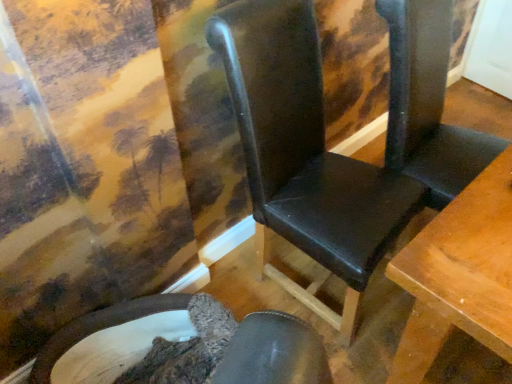
What do you see at coordinates (428, 103) in the screenshot? I see `black leather folding chair at center` at bounding box center [428, 103].

Measure the distance between velvet-like brown chair at lower left, the first chair when ordered from left to right, and camera.

velvet-like brown chair at lower left, the first chair when ordered from left to right, is 4.50 feet away from camera.

What is the approximate height of black leather chair at center, positioned as the first chair in right-to-left order?

3.62 feet.

This screenshot has height=384, width=512. I want to click on black leather folding chair at center, so click(x=428, y=103).

Is point (103, 369) positioned after point (467, 155)?

No, it is in front of (467, 155).

Considering the relative sizes of velvet-like brown chair at lower left, the first chair when ordered from left to right, and black leather folding chair at center in the image provided, is velvet-like brown chair at lower left, the first chair when ordered from left to right, thinner than black leather folding chair at center?

In fact, velvet-like brown chair at lower left, the first chair when ordered from left to right, might be wider than black leather folding chair at center.

Could you tell me if velvet-like brown chair at lower left, the first chair when ordered from left to right, is facing black leather folding chair at center?

No, velvet-like brown chair at lower left, the first chair when ordered from left to right, does not turn towards black leather folding chair at center.

Can you confirm if velvet-like brown chair at lower left, placed as the 2th chair when sorted from right to left, is bigger than black leather folding chair at center?

No, velvet-like brown chair at lower left, placed as the 2th chair when sorted from right to left, is not bigger than black leather folding chair at center.

Which object is wider, black leather chair at center, which is the second chair from left to right, or black leather folding chair at center?

black leather chair at center, which is the second chair from left to right, is wider.

Considering the sizes of black leather chair at center, positioned as the first chair in right-to-left order, and black leather folding chair at center in the image, is black leather chair at center, positioned as the first chair in right-to-left order, taller or shorter than black leather folding chair at center?

black leather chair at center, positioned as the first chair in right-to-left order, is shorter than black leather folding chair at center.

Which object is further away from the camera, black leather chair at center, which is the second chair from left to right, or black leather folding chair at center?

Positioned behind is black leather folding chair at center.

Is the surface of black leather folding chair at center in direct contact with black leather chair at center, positioned as the first chair in right-to-left order?

black leather folding chair at center and black leather chair at center, positioned as the first chair in right-to-left order, are clearly separated.

Would you say black leather chair at center, positioned as the first chair in right-to-left order, is part of black leather folding chair at center's contents?

No.

Is black leather chair at center, which is the second chair from left to right, at the back of black leather folding chair at center?

black leather folding chair at center is not turned away from black leather chair at center, which is the second chair from left to right.

Is point (391, 66) positioned after point (417, 76)?

Yes, it is.

Based on their sizes in the image, would you say velvet-like brown chair at lower left, the first chair when ordered from left to right, is bigger or smaller than black leather chair at center, positioned as the first chair in right-to-left order?

velvet-like brown chair at lower left, the first chair when ordered from left to right, is smaller than black leather chair at center, positioned as the first chair in right-to-left order.

Considering the relative sizes of velvet-like brown chair at lower left, the first chair when ordered from left to right, and black leather chair at center, which is the second chair from left to right, in the image provided, is velvet-like brown chair at lower left, the first chair when ordered from left to right, taller than black leather chair at center, which is the second chair from left to right,?

No, velvet-like brown chair at lower left, the first chair when ordered from left to right, is not taller than black leather chair at center, which is the second chair from left to right.

In the scene shown: Would you say velvet-like brown chair at lower left, the first chair when ordered from left to right, contains black leather chair at center, which is the second chair from left to right?

No.

Can you tell me how much velvet-like brown chair at lower left, the first chair when ordered from left to right, and black leather chair at center, which is the second chair from left to right, differ in facing direction?

velvet-like brown chair at lower left, the first chair when ordered from left to right, and black leather chair at center, which is the second chair from left to right, are facing 4.9 degrees away from each other.

Is velvet-like brown chair at lower left, the first chair when ordered from left to right, completely or partially inside black leather folding chair at center?

Actually, velvet-like brown chair at lower left, the first chair when ordered from left to right, is outside black leather folding chair at center.

Is black leather folding chair at center with velvet-like brown chair at lower left, the first chair when ordered from left to right?

No, black leather folding chair at center is not beside velvet-like brown chair at lower left, the first chair when ordered from left to right.

Is the depth of black leather folding chair at center greater than that of velvet-like brown chair at lower left, the first chair when ordered from left to right?

Yes, black leather folding chair at center is further from the viewer.

Does black leather folding chair at center turn towards velvet-like brown chair at lower left, the first chair when ordered from left to right?

No, black leather folding chair at center is not aimed at velvet-like brown chair at lower left, the first chair when ordered from left to right.

Can we say black leather chair at center, which is the second chair from left to right, lies outside velvet-like brown chair at lower left, the first chair when ordered from left to right?

Indeed, black leather chair at center, which is the second chair from left to right, is completely outside velvet-like brown chair at lower left, the first chair when ordered from left to right.

The height and width of the screenshot is (384, 512). In order to click on chair that appears on the left of black leather chair at center, positioned as the first chair in right-to-left order in this screenshot , I will do `click(109, 337)`.

Between point (256, 67) and point (61, 338), which one is positioned behind?

Positioned behind is point (61, 338).

Between black leather chair at center, which is the second chair from left to right, and velvet-like brown chair at lower left, the first chair when ordered from left to right, which one has less height?

With less height is velvet-like brown chair at lower left, the first chair when ordered from left to right.

Where is `the 2nd chair below the black leather folding chair at center (from a real-world perspective)`? the 2nd chair below the black leather folding chair at center (from a real-world perspective) is located at coordinates (109, 337).

Starting from the black leather folding chair at center, which chair is the 2nd one in front? Please provide its 2D coordinates.

[(337, 154)]

Which object lies further to the anchor point black leather folding chair at center, velvet-like brown chair at lower left, the first chair when ordered from left to right, or black leather chair at center, which is the second chair from left to right?

Based on the image, velvet-like brown chair at lower left, the first chair when ordered from left to right, appears to be further to black leather folding chair at center.

Considering their positions, is black leather folding chair at center positioned further to velvet-like brown chair at lower left, placed as the 2th chair when sorted from right to left, than black leather chair at center, which is the second chair from left to right?

black leather folding chair at center.

Looking at the image, which one is located further to black leather chair at center, which is the second chair from left to right, velvet-like brown chair at lower left, the first chair when ordered from left to right, or black leather folding chair at center?

Among the two, velvet-like brown chair at lower left, the first chair when ordered from left to right, is located further to black leather chair at center, which is the second chair from left to right.

When comparing their distances from black leather chair at center, which is the second chair from left to right, does black leather folding chair at center or velvet-like brown chair at lower left, the first chair when ordered from left to right, seem further?

velvet-like brown chair at lower left, the first chair when ordered from left to right, is positioned further to the anchor black leather chair at center, which is the second chair from left to right.

Looking at the image, which one is located closer to velvet-like brown chair at lower left, placed as the 2th chair when sorted from right to left, black leather chair at center, which is the second chair from left to right, or black leather folding chair at center?

Based on the image, black leather chair at center, which is the second chair from left to right, appears to be nearer to velvet-like brown chair at lower left, placed as the 2th chair when sorted from right to left.

When comparing their distances from black leather folding chair at center, does black leather chair at center, which is the second chair from left to right, or velvet-like brown chair at lower left, placed as the 2th chair when sorted from right to left, seem further?

velvet-like brown chair at lower left, placed as the 2th chair when sorted from right to left, is further to black leather folding chair at center.

Locate an element on the screen. The width and height of the screenshot is (512, 384). chair between velvet-like brown chair at lower left, placed as the 2th chair when sorted from right to left, and black leather folding chair at center from left to right is located at coordinates (337, 154).